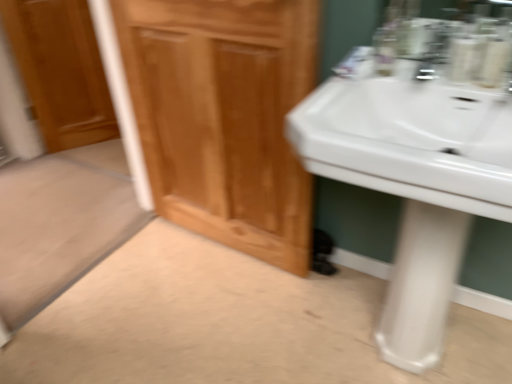
I want to click on vacant space positioned to the left of white glossy pedestal at lower right, so click(x=347, y=336).